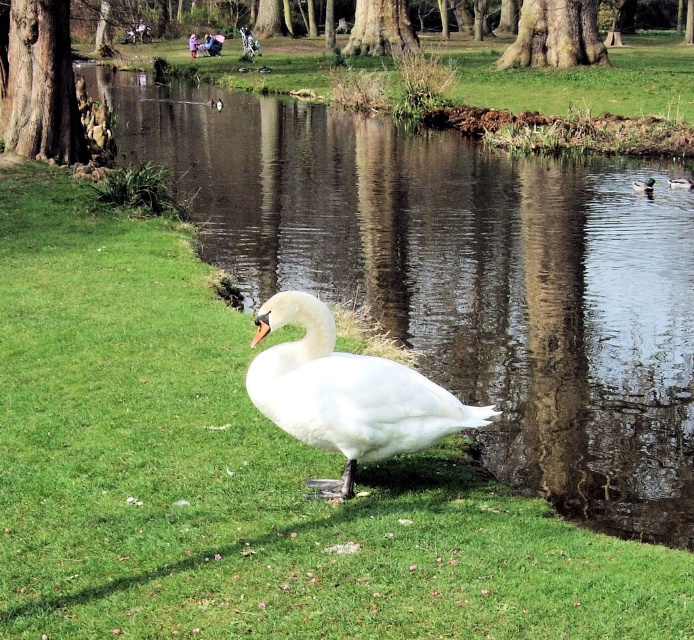
Question: Which point is closer to the camera?

Choices:
 (A) green glossy duck at right
 (B) brown fuzzy duck at center
 (C) white feathered swan at center

Answer: (C)

Question: Considering the relative positions of clear water at center and brown fuzzy duck at center in the image provided, where is clear water at center located with respect to brown fuzzy duck at center?

Choices:
 (A) below
 (B) above

Answer: (B)

Question: Estimate the real-world distances between objects in this image. Which object is farther from the white feathered swan at center?

Choices:
 (A) brown fuzzy duck at center
 (B) green glossy duck at right
 (C) clear water at center

Answer: (A)

Question: Which object appears closest to the camera in this image?

Choices:
 (A) brown fuzzy duck at center
 (B) green glossy duck at right

Answer: (B)

Question: Is green glossy duck at right behind brown fuzzy duck at center?

Choices:
 (A) no
 (B) yes

Answer: (A)

Question: Does green glossy duck at right appear on the left side of brown fuzzy duck at center?

Choices:
 (A) yes
 (B) no

Answer: (A)